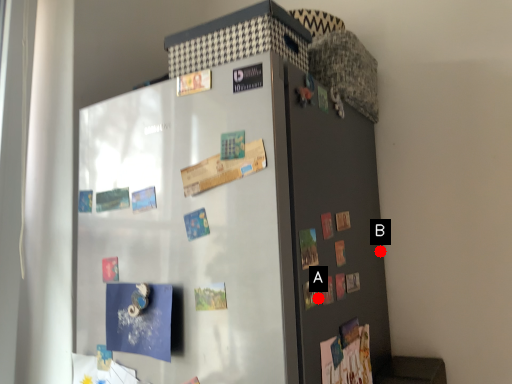
Question: Two points are circled on the image, labeled by A and B beside each circle. Which of the following is the farthest from the observer?

Choices:
 (A) A is further
 (B) B is further

Answer: (B)